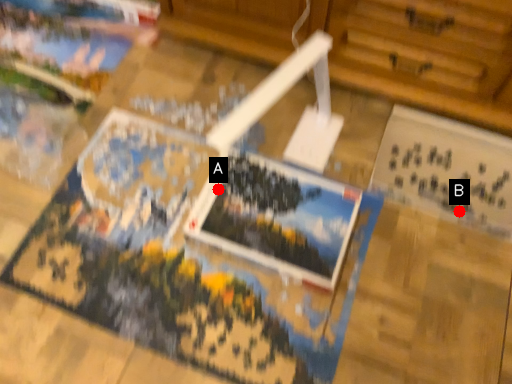
Question: Two points are circled on the image, labeled by A and B beside each circle. Which point is closer to the camera?

Choices:
 (A) A is closer
 (B) B is closer

Answer: (A)